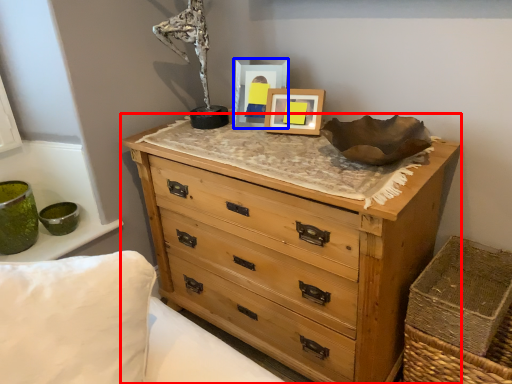
Question: Among these objects, which one is farthest to the camera, chest of drawers (highlighted by a red box) or picture frame (highlighted by a blue box)?

Choices:
 (A) chest of drawers
 (B) picture frame

Answer: (B)